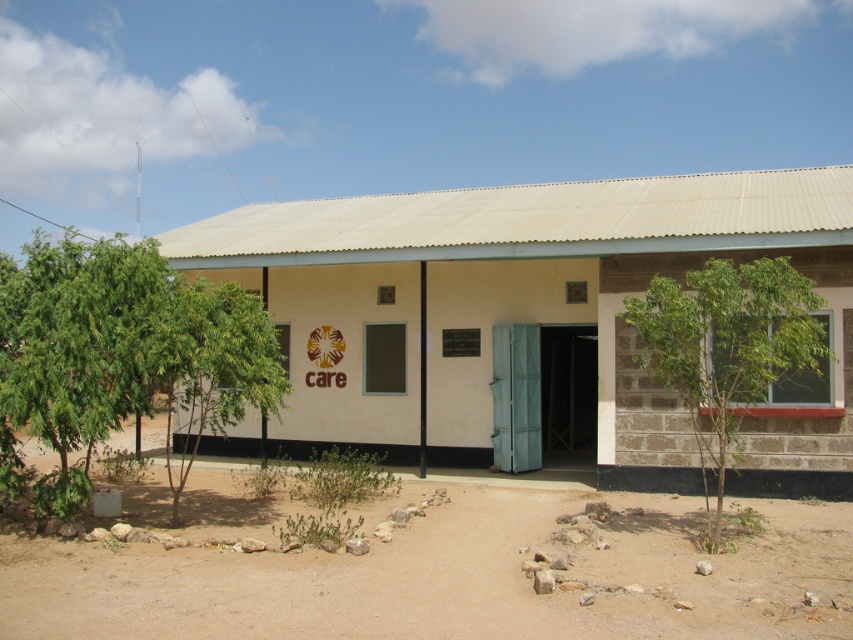
Question: Is white matte building at center to the right of green leafy tree at right from the viewer's perspective?

Choices:
 (A) no
 (B) yes

Answer: (A)

Question: Can you confirm if green leafy tree at lower left is thinner than green leafy tree at right?

Choices:
 (A) yes
 (B) no

Answer: (B)

Question: Considering the relative positions of white matte building at center and green leafy tree at right in the image provided, where is white matte building at center located with respect to green leafy tree at right?

Choices:
 (A) left
 (B) right

Answer: (A)

Question: Estimate the real-world distances between objects in this image. Which object is closer to the brown sandy dirt at lower center?

Choices:
 (A) white matte building at center
 (B) green leafy tree at right
 (C) green leafy tree at lower left

Answer: (B)

Question: Which object appears farthest from the camera in this image?

Choices:
 (A) brown sandy dirt at lower center
 (B) green leafy tree at right
 (C) green leafy tree at lower left
 (D) white matte building at center

Answer: (D)

Question: Which of the following is the closest to the observer?

Choices:
 (A) green leafy tree at right
 (B) white matte building at center
 (C) brown sandy dirt at lower center

Answer: (A)